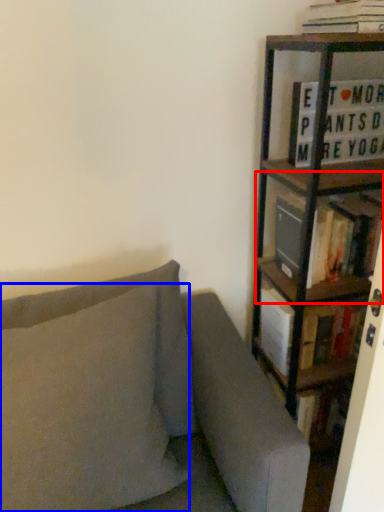
Question: Which object appears farthest to the camera in this image, shelf (highlighted by a red box) or pillow (highlighted by a blue box)?

Choices:
 (A) shelf
 (B) pillow

Answer: (A)